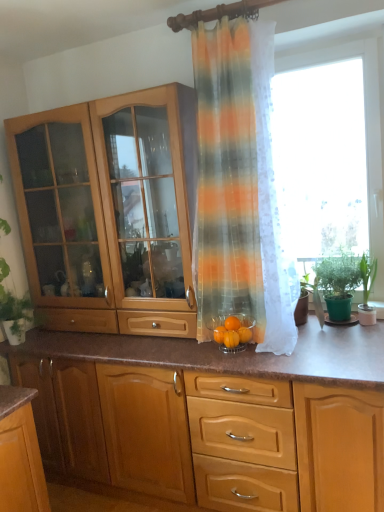
In order to click on free spot in front of orange matte glass bowl at center, the first orange from the right in this screenshot , I will do `click(259, 352)`.